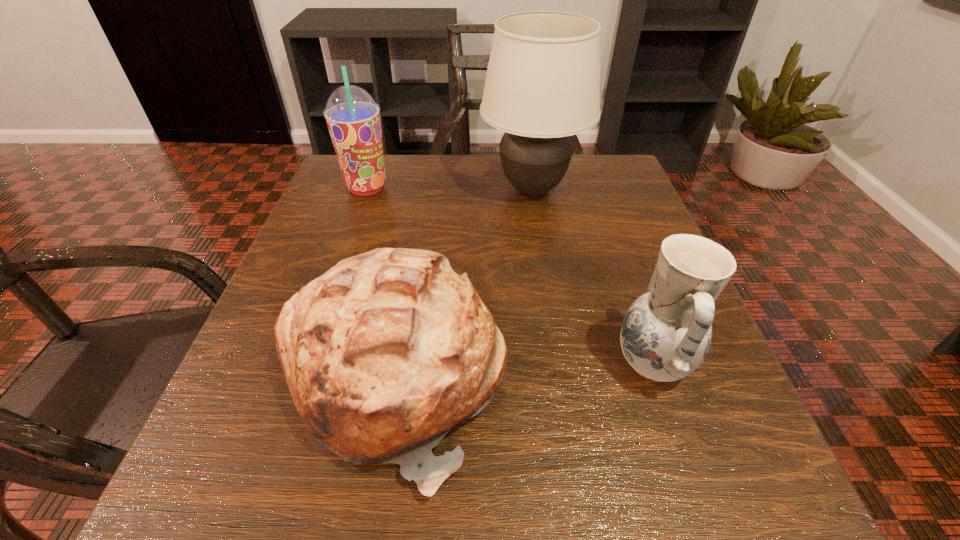
In order to click on free space at the far edge of the desktop in this screenshot , I will do `click(477, 187)`.

Image resolution: width=960 pixels, height=540 pixels. In the image, there is a desktop. Find the location of `vacant space at the near edge`. vacant space at the near edge is located at coordinates (570, 455).

In the image, there is a desktop. Identify the location of vacant area at the left edge. (334, 231).

The height and width of the screenshot is (540, 960). Find the location of `free region at the right edge of the desktop`. free region at the right edge of the desktop is located at coordinates (691, 386).

Find the location of a particular element. vacant space at the far left corner of the desktop is located at coordinates (355, 202).

In the image, there is a desktop. At what (x,y) coordinates should I click in order to perform the action: click on vacant space at the near left corner. Please return your answer as a coordinate pair (x, y). The width and height of the screenshot is (960, 540). Looking at the image, I should click on (205, 478).

The image size is (960, 540). I want to click on free location at the far right corner of the desktop, so click(580, 161).

Where is `vacant area that lies between the smoothie and the pottery`? The width and height of the screenshot is (960, 540). vacant area that lies between the smoothie and the pottery is located at coordinates click(x=510, y=275).

At what (x,y) coordinates should I click in order to perform the action: click on free point between the lampshade and the pottery. Please return your answer as a coordinate pair (x, y). Looking at the image, I should click on (592, 276).

At what (x,y) coordinates should I click in order to perform the action: click on vacant space that's between the smoothie and the tallest object. Please return your answer as a coordinate pair (x, y). This screenshot has height=540, width=960. Looking at the image, I should click on (449, 189).